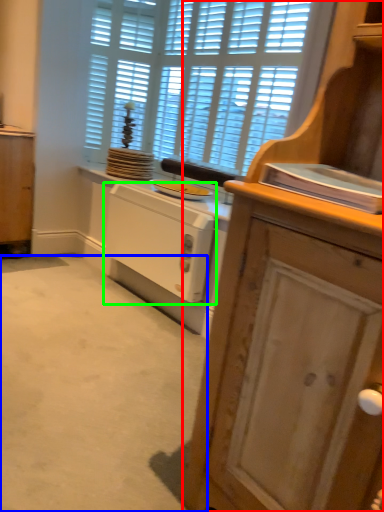
Question: Which object is positioned closest to cabinetry (highlighted by a red box)? Select from plain (highlighted by a blue box) and home appliance (highlighted by a green box).

Choices:
 (A) plain
 (B) home appliance

Answer: (A)